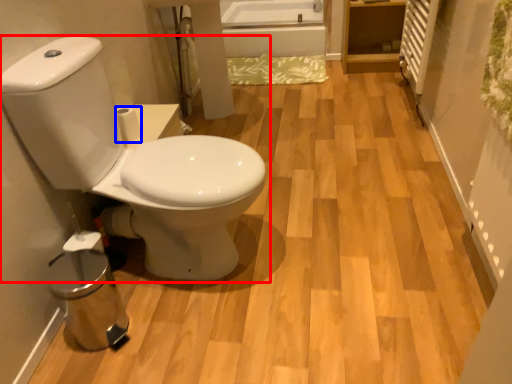
Question: Among these objects, which one is nearest to the camera, toilet (highlighted by a red box) or toilet paper (highlighted by a blue box)?

Choices:
 (A) toilet
 (B) toilet paper

Answer: (A)